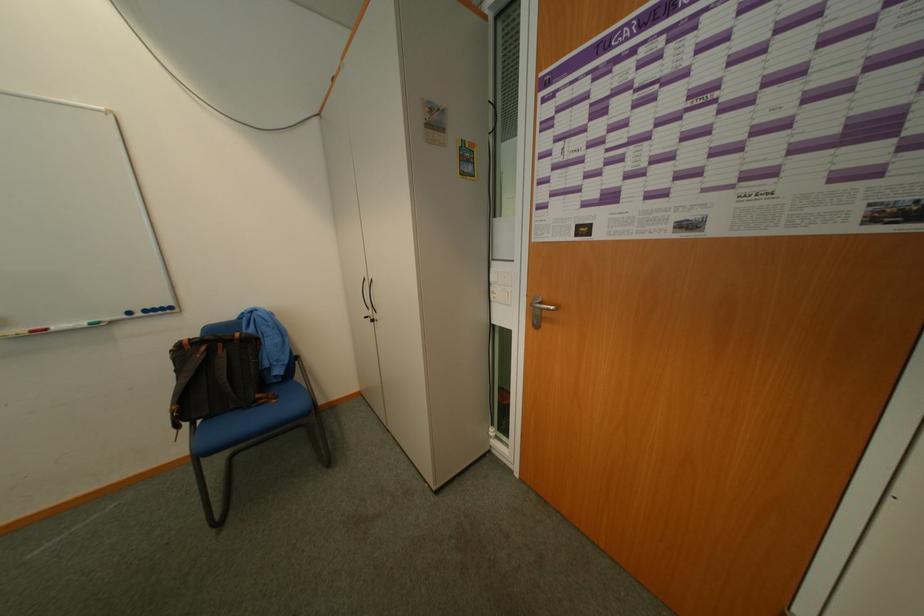
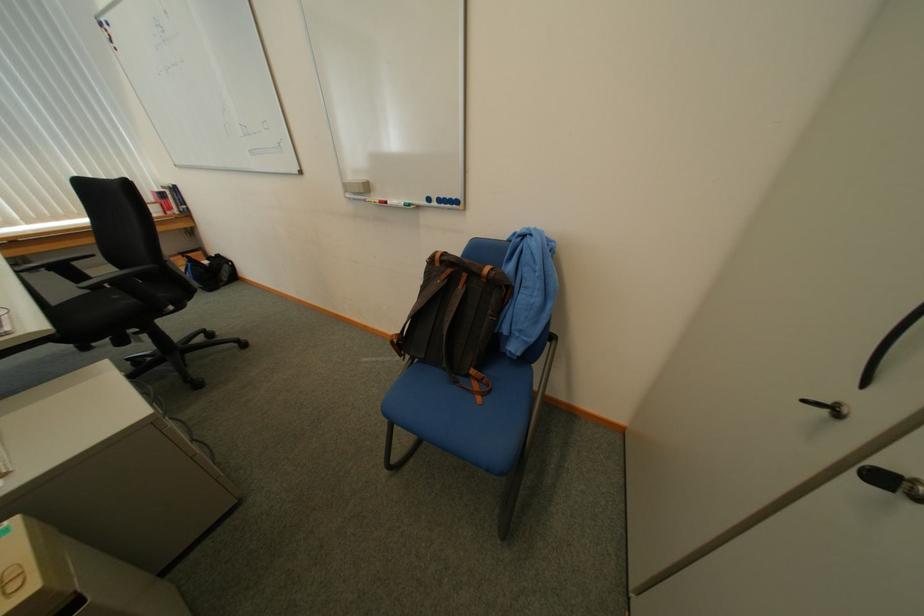
Find the pixel in the second image that matches pixel 231 354 in the first image.

(469, 290)